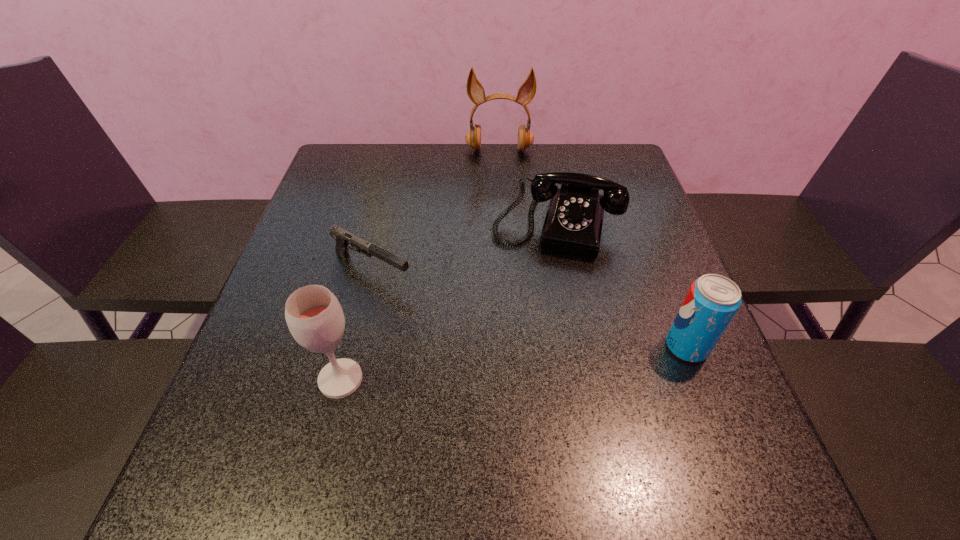
The image size is (960, 540). Find the location of `the fourth shortest object`. the fourth shortest object is located at coordinates (314, 316).

I want to click on the rightmost object, so point(712,301).

At what (x,y) coordinates should I click in order to perform the action: click on the farthest object. Please return your answer as a coordinate pair (x, y). The width and height of the screenshot is (960, 540). Looking at the image, I should click on (475, 90).

Image resolution: width=960 pixels, height=540 pixels. I want to click on earphone, so click(475, 90).

Identify the location of telephone. Image resolution: width=960 pixels, height=540 pixels. (573, 224).

I want to click on gun, so click(x=343, y=238).

You are a GUI agent. You are given a task and a screenshot of the screen. Output one action in this format:
    pyautogui.click(x=<x>, y=<y>)
    Task: Click on the vacant area situated 0.400m on the back of the second tallest object
    
    Given the screenshot: What is the action you would take?
    pyautogui.click(x=379, y=225)

You are a GUI agent. You are given a task and a screenshot of the screen. Output one action in this format:
    pyautogui.click(x=<x>, y=<y>)
    Task: Click on the vacant space situated 0.250m on the left of the soda can
    The width and height of the screenshot is (960, 540).
    Given the screenshot: What is the action you would take?
    pyautogui.click(x=537, y=347)

Where is `free space located on the front-facing side of the farthest object`? The height and width of the screenshot is (540, 960). free space located on the front-facing side of the farthest object is located at coordinates (499, 199).

Identify the location of vacant point located 0.340m on the front-facing side of the farthest object. Image resolution: width=960 pixels, height=540 pixels. (500, 231).